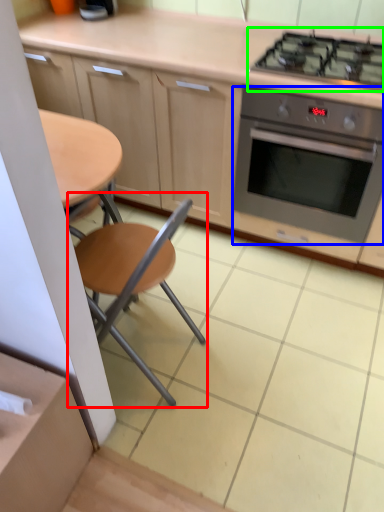
Question: Based on their relative distances, which object is nearer to chair (highlighted by a red box)? Choose from kitchen appliance (highlighted by a blue box) and gas stove (highlighted by a green box).

Choices:
 (A) kitchen appliance
 (B) gas stove

Answer: (A)